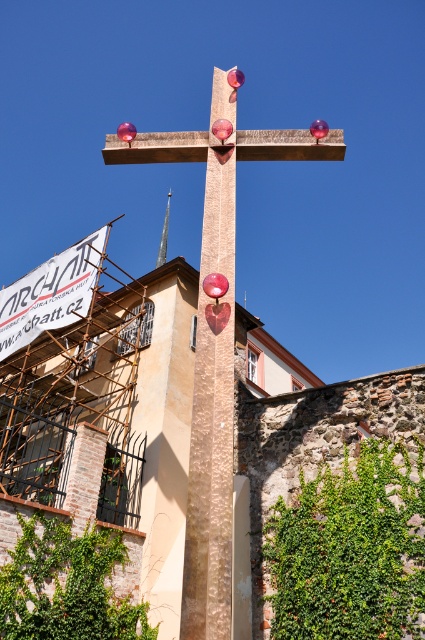
Question: Can you confirm if wooden cross at center is positioned below silver metallic spire at center?

Choices:
 (A) no
 (B) yes

Answer: (A)

Question: Is wooden cross at center in front of silver metallic spire at center?

Choices:
 (A) no
 (B) yes

Answer: (B)

Question: Does wooden cross at center appear over silver metallic spire at center?

Choices:
 (A) yes
 (B) no

Answer: (A)

Question: Which point is farther to the camera?

Choices:
 (A) wooden cross at center
 (B) silver metallic spire at center

Answer: (B)